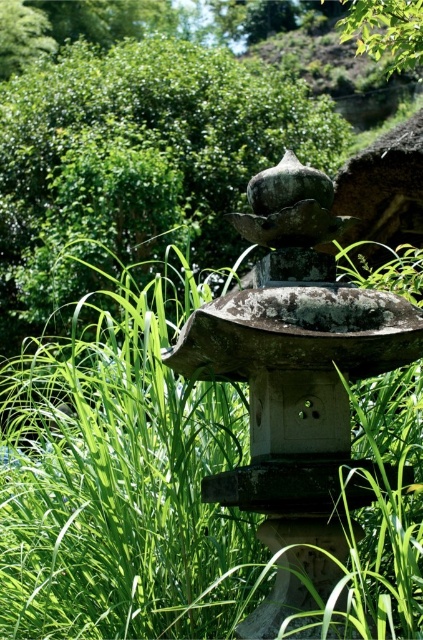
Question: Which object appears closest to the camera in this image?

Choices:
 (A) green leafy bush at upper center
 (B) green grass at center

Answer: (B)

Question: Which point appears closest to the camera in this image?

Choices:
 (A) (101, 381)
 (B) (8, 248)

Answer: (A)

Question: Is green grass at center below green leafy bush at upper center?

Choices:
 (A) no
 (B) yes

Answer: (B)

Question: Is green grass at center in front of green leafy bush at upper center?

Choices:
 (A) yes
 (B) no

Answer: (A)

Question: Observing the image, what is the correct spatial positioning of green grass at center in reference to green leafy bush at upper center?

Choices:
 (A) above
 (B) below

Answer: (B)

Question: Which object is closer to the camera taking this photo?

Choices:
 (A) green leafy bush at upper center
 (B) green grass at center

Answer: (B)